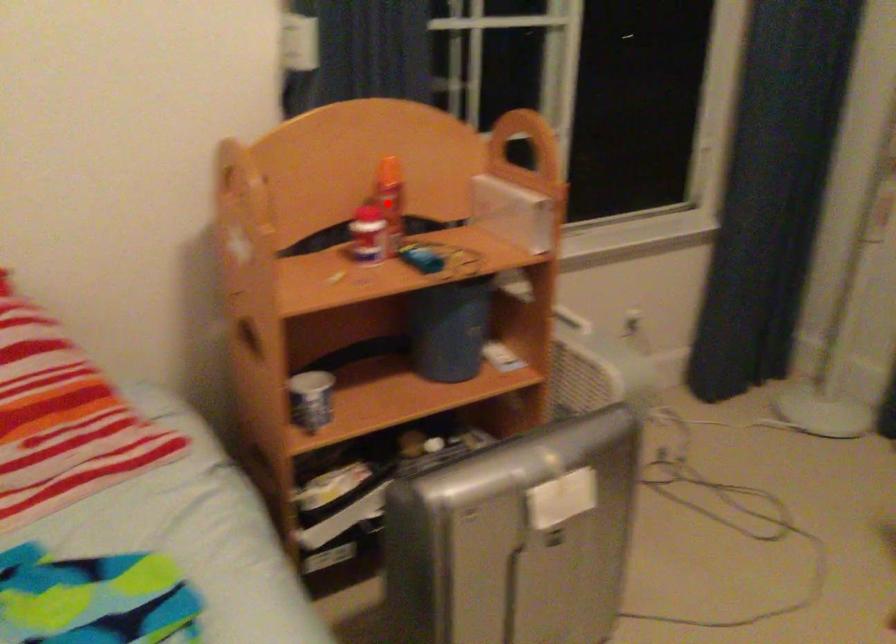
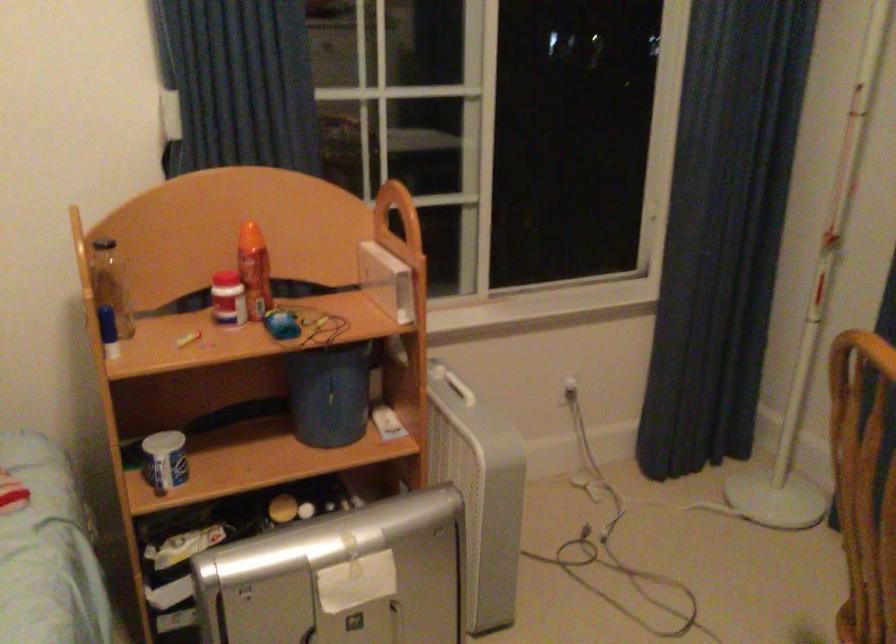
Where in the second image is the point corresponding to the highlighted location from the first image?

(254, 270)